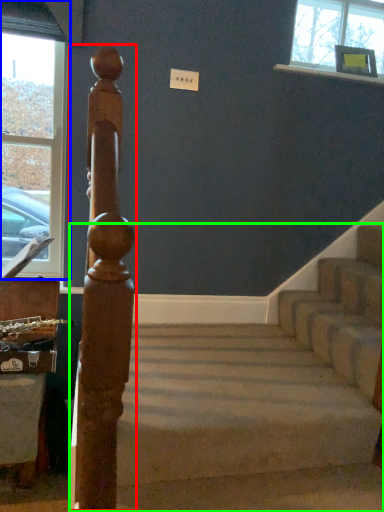
Question: Estimate the real-world distances between objects in this image. Which object is closer to beam (highlighted by a red box), window (highlighted by a blue box) or stairs (highlighted by a green box)?

Choices:
 (A) window
 (B) stairs

Answer: (B)